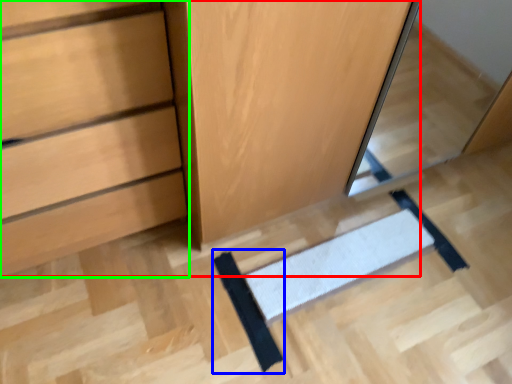
Question: Estimate the real-world distances between objects in this image. Which object is farther from dresser (highlighted by a red box), doormat (highlighted by a blue box) or chest of drawers (highlighted by a green box)?

Choices:
 (A) doormat
 (B) chest of drawers

Answer: (A)